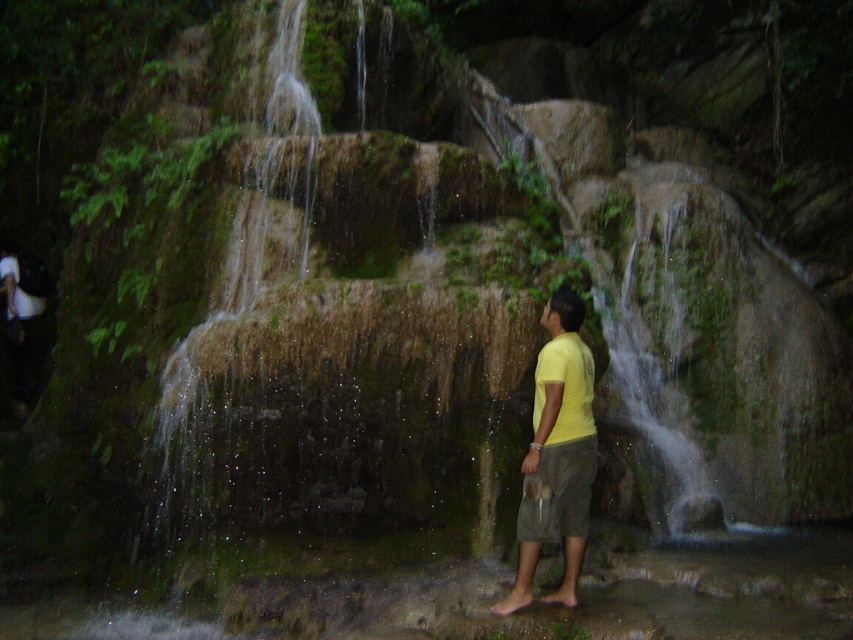
Who is more distant from viewer, (558, 358) or (521, 488)?

The point (521, 488) is more distant.

What do you see at coordinates (556, 454) in the screenshot? I see `yellow matte shirt at center` at bounding box center [556, 454].

Describe the element at coordinates (556, 454) in the screenshot. The image size is (853, 640). I see `yellow matte shirt at center` at that location.

Find the location of a particular element. The image size is (853, 640). yellow matte shirt at center is located at coordinates (556, 454).